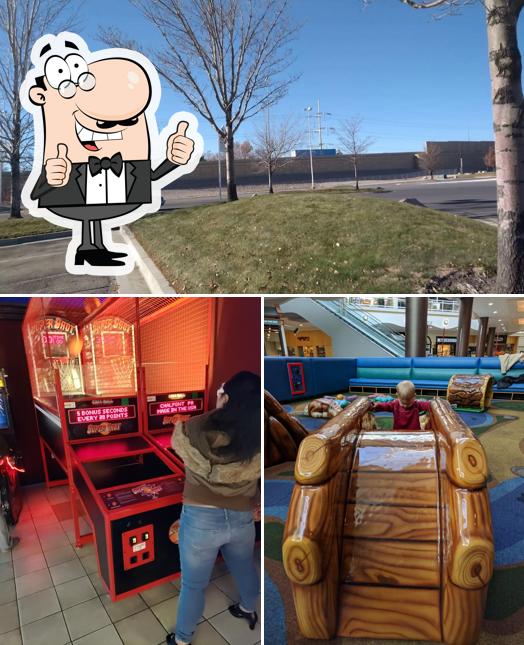
Find the location of a particular element. Image resolution: width=524 pixels, height=645 pixels. brown support column is located at coordinates (491, 346), (481, 344), (461, 342), (414, 335).